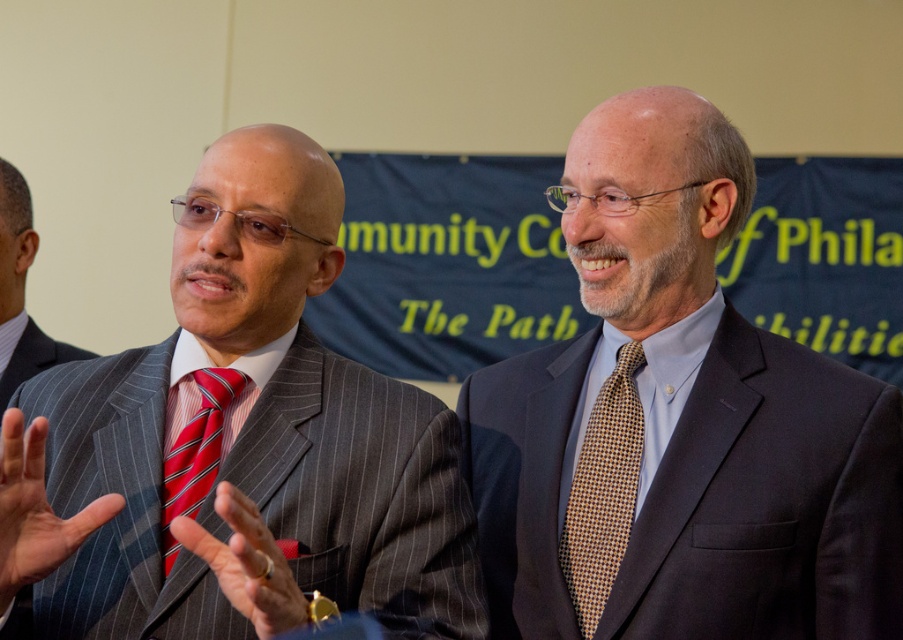
You are a photographer trying to capture a closeup of the banner text in the background. You notice two points on the banner marked as point (2, 540) and point (26, 364). Which point should you focus on to ensure the banner text is sharp in your photo?

Point (2, 540) is closer to the camera than point (26, 364), so focusing on point (2, 540) will ensure the banner text is sharp.

You are a photographer at an event and need to adjust the camera focus to capture both men clearly. Since the dark blue suit at center and the gray pinstripe suit at center are different in size, which one should you focus on first to ensure proper framing?

The dark blue suit at center is smaller than the gray pinstripe suit at center, so you should focus on the gray pinstripe suit at center first to ensure proper framing because it takes up more space in the frame.